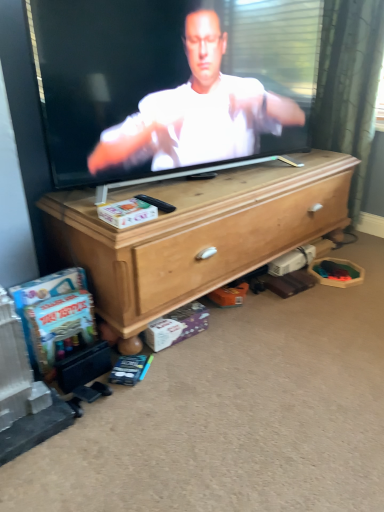
At what (x,y) coordinates should I click in order to perform the action: click on black plastic remote control at center. Please return your answer as a coordinate pair (x, y). The width and height of the screenshot is (384, 512). Looking at the image, I should click on (157, 203).

Find the location of a particular element. The width and height of the screenshot is (384, 512). smooth white shirt at center is located at coordinates (197, 112).

Is black plastic remote control at center facing away from wooden chest of drawers at center?

No, black plastic remote control at center is not facing away from wooden chest of drawers at center.

Which of these two, black plastic remote control at center or wooden chest of drawers at center, stands shorter?

With less height is black plastic remote control at center.

Is black plastic remote control at center not near wooden chest of drawers at center?

That's not correct — black plastic remote control at center is a little close to wooden chest of drawers at center.

From the image's perspective, which object appears higher, smooth white shirt at center or black plastic remote control at center?

smooth white shirt at center is shown above in the image.

Could you tell me if smooth white shirt at center is turned towards black plastic remote control at center?

Yes, smooth white shirt at center faces towards black plastic remote control at center.

Can you tell me how much smooth white shirt at center and black plastic remote control at center differ in facing direction?

5.65 degrees.

Is smooth white shirt at center beside black plastic remote control at center?

No, smooth white shirt at center is not making contact with black plastic remote control at center.

How distant is wooden chest of drawers at center from smooth white shirt at center?

11.87 inches.

Does wooden chest of drawers at center have a larger size compared to smooth white shirt at center?

Correct, wooden chest of drawers at center is larger in size than smooth white shirt at center.

Based on their positions, is wooden chest of drawers at center located to the left or right of smooth white shirt at center?

wooden chest of drawers at center is positioned on smooth white shirt at center's right side.

The width and height of the screenshot is (384, 512). What are the coordinates of `chest of drawers on the right of smooth white shirt at center` in the screenshot? It's located at (196, 234).

From the image's perspective, is wooden chest of drawers at center on top of black plastic remote control at center?

Incorrect, from the image's perspective, wooden chest of drawers at center is lower than black plastic remote control at center.

Which is further, (129, 347) or (151, 203)?

Point (151, 203)

Would you consider wooden chest of drawers at center to be distant from black plastic remote control at center?

wooden chest of drawers at center is near black plastic remote control at center, not far away.

How many degrees apart are the facing directions of black plastic remote control at center and smooth white shirt at center?

There is a 5.65-degree angle between the facing directions of black plastic remote control at center and smooth white shirt at center.

Which is in front, black plastic remote control at center or smooth white shirt at center?

smooth white shirt at center is more forward.

From the picture: Is black plastic remote control at center spatially inside smooth white shirt at center, or outside of it?

black plastic remote control at center lies outside smooth white shirt at center.

Locate an element on the screen. person in front of the black plastic remote control at center is located at coordinates (197, 112).

From the image's perspective, is smooth white shirt at center on top of wooden chest of drawers at center?

Indeed, from the image's perspective, smooth white shirt at center is shown above wooden chest of drawers at center.

In the scene shown: Is smooth white shirt at center taller than wooden chest of drawers at center?

Yes, smooth white shirt at center is taller than wooden chest of drawers at center.

Considering the relative positions of smooth white shirt at center and wooden chest of drawers at center in the image provided, is smooth white shirt at center to the left of wooden chest of drawers at center from the viewer's perspective?

Yes, smooth white shirt at center is to the left of wooden chest of drawers at center.

Is smooth white shirt at center situated inside wooden chest of drawers at center or outside?

smooth white shirt at center lies outside wooden chest of drawers at center.

The image size is (384, 512). What are the coordinates of `the chest of drawers that appears below the black plastic remote control at center (from a real-world perspective)` in the screenshot? It's located at (196, 234).

At what (x,y) coordinates should I click in order to perform the action: click on person in front of the black plastic remote control at center. Please return your answer as a coordinate pair (x, y). Looking at the image, I should click on (197, 112).

When comparing their distances from smooth white shirt at center, does black plastic remote control at center or wooden chest of drawers at center seem closer?

wooden chest of drawers at center.

Considering their positions, is smooth white shirt at center positioned closer to wooden chest of drawers at center than black plastic remote control at center?

smooth white shirt at center is positioned closer to the anchor wooden chest of drawers at center.

When comparing their distances from smooth white shirt at center, does wooden chest of drawers at center or black plastic remote control at center seem closer?

wooden chest of drawers at center is positioned closer to the anchor smooth white shirt at center.

Considering their positions, is black plastic remote control at center positioned closer to wooden chest of drawers at center than smooth white shirt at center?

smooth white shirt at center lies closer to wooden chest of drawers at center than the other object.

Which object lies further to the anchor point black plastic remote control at center, smooth white shirt at center or wooden chest of drawers at center?

Based on the image, smooth white shirt at center appears to be further to black plastic remote control at center.

Estimate the real-world distances between objects in this image. Which object is further from black plastic remote control at center, wooden chest of drawers at center or smooth white shirt at center?

smooth white shirt at center lies further to black plastic remote control at center than the other object.

Find the location of a particular element. remote control between smooth white shirt at center and wooden chest of drawers at center in the vertical direction is located at coordinates (157, 203).